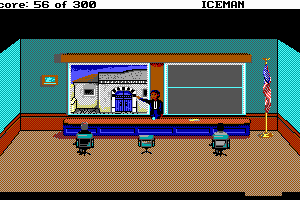
Locate an element on the screen. The image size is (300, 200). checkered brown floor is located at coordinates (127, 174).